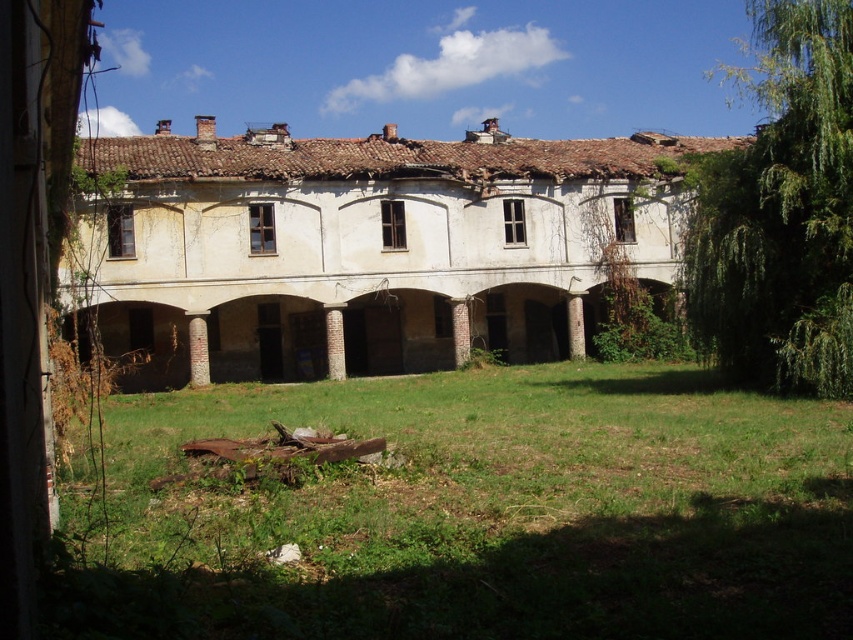
Question: Among these points, which one is farthest from the camera?

Choices:
 (A) (466, 337)
 (B) (201, 349)

Answer: (A)

Question: Can you confirm if white brick column at center is positioned above red brick pillar at center?

Choices:
 (A) no
 (B) yes

Answer: (A)

Question: Which point appears farthest from the camera in this image?

Choices:
 (A) (339, 380)
 (B) (461, 307)
 (C) (189, 321)

Answer: (B)

Question: Can you confirm if white brick column at center is positioned to the right of red brick pillar at center?

Choices:
 (A) no
 (B) yes

Answer: (A)

Question: Does white brick column at center appear under brown stone column at center?

Choices:
 (A) no
 (B) yes

Answer: (B)

Question: Which object is closer to the camera taking this photo?

Choices:
 (A) white brick column at center
 (B) red brick pillar at center

Answer: (A)